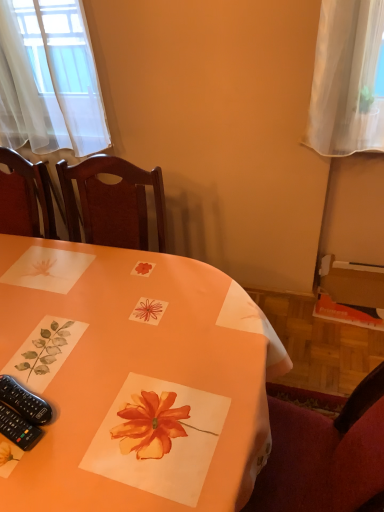
I want to click on vacant space in front of black plastic remote control at lower left, which is counted as the first remote control, starting from the top, so click(x=43, y=475).